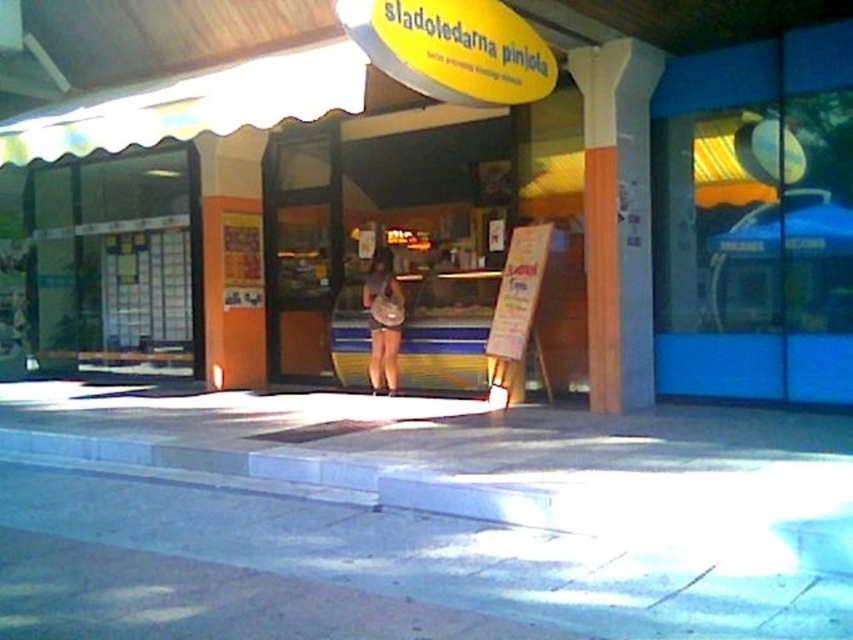
You are a delivery person trying to place a matte brown purse at center on the gray concrete pavement at center. Will the purse be placed entirely on the pavement?

The gray concrete pavement at center has a lesser height compared to matte brown purse at center, so the purse can be placed entirely on the pavement since the pavement is lower and the purse is taller.